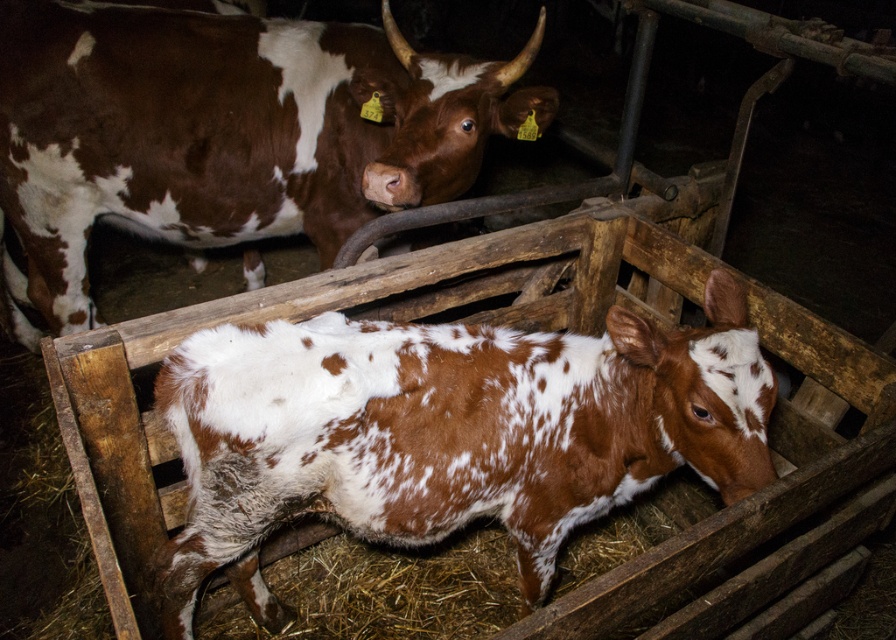
You are a farmer checking on your cows. You notice two cows with brown speckled fur at center and brown speckled hide at center in the barn. How far apart are these two cows from each other?

The brown speckled fur at center and brown speckled hide at center are 5.21 feet apart from each other.

You are a farmer checking the cows in the barn. You notice two cows with brown speckled patterns. Which one has a narrower width between the brown speckled fur at center and the brown speckled hide at center?

The brown speckled fur at center has a lesser width compared to brown speckled hide at center, so the brown speckled fur at center is narrower.

You are a farmer checking the cows in the barn. You notice the brown speckled fur at center. Where exactly is this fur located in the barn?

The brown speckled fur at center is located at point (x=446, y=433) in the barn.